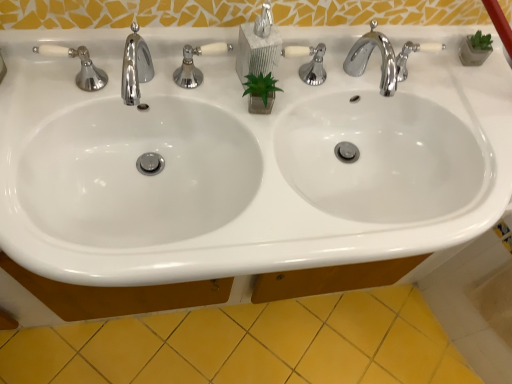
What are the coordinates of `empty space that is to the right of matte gray soap dispenser at center` in the screenshot? It's located at (317, 83).